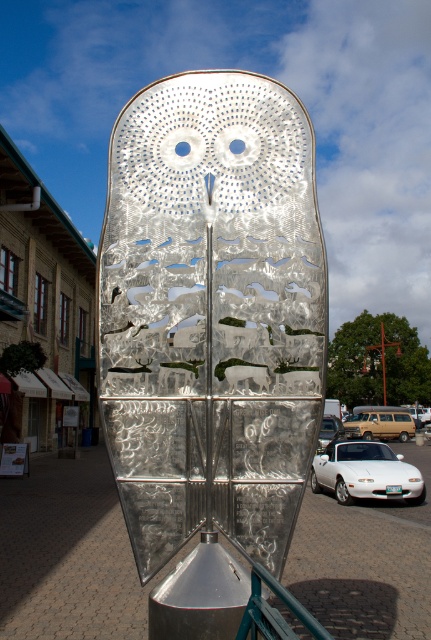
Question: Can you confirm if white glossy car at lower center is positioned below white glossy car at center?

Choices:
 (A) no
 (B) yes

Answer: (A)

Question: Which of the following is the closest to the observer?

Choices:
 (A) (168, 547)
 (B) (250, 608)
 (C) (381, 458)

Answer: (B)

Question: Is metal/textured rail at lower center closer to camera compared to white glossy car at center?

Choices:
 (A) yes
 (B) no

Answer: (A)

Question: Is metal/textured rail at lower center above white glossy car at center?

Choices:
 (A) no
 (B) yes

Answer: (B)

Question: Which of these objects is positioned farthest from the metallic owl at center?

Choices:
 (A) white glossy car at lower center
 (B) metal/textured rail at lower center
 (C) white glossy car at center

Answer: (A)

Question: Which of the following is the farthest from the observer?

Choices:
 (A) (318, 432)
 (B) (396, 429)

Answer: (B)